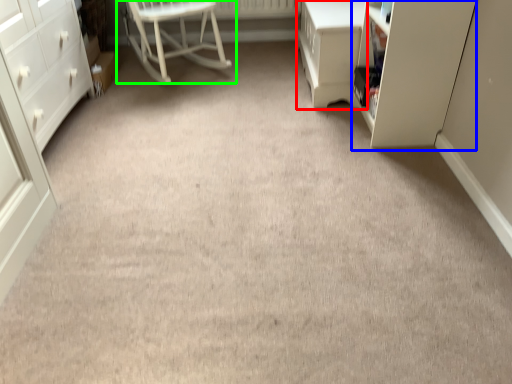
Question: Which object is the closest to the vanity (highlighted by a red box)? Choose among these: cabinetry (highlighted by a blue box) or chair (highlighted by a green box).

Choices:
 (A) cabinetry
 (B) chair

Answer: (A)